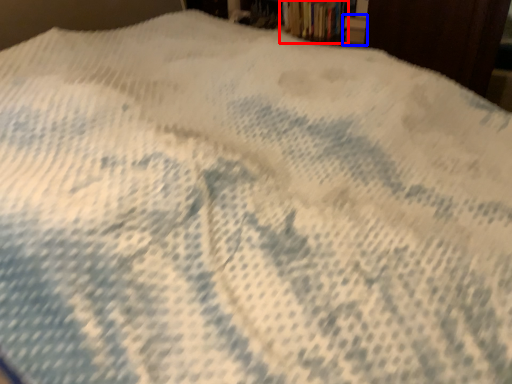
Question: Which object is further to the camera taking this photo, book (highlighted by a red box) or paperback book (highlighted by a blue box)?

Choices:
 (A) book
 (B) paperback book

Answer: (A)